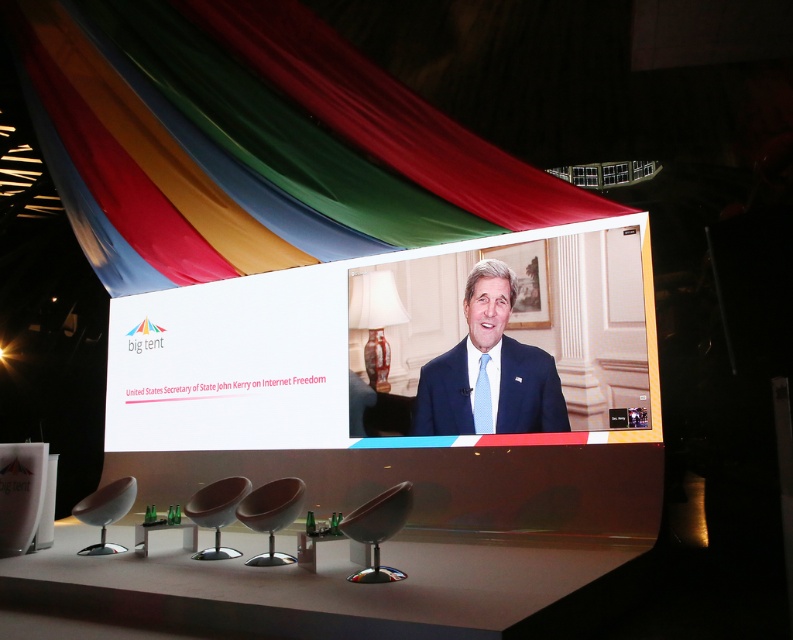
Consider the image. Can you confirm if white glossy projection screen at center is bigger than blue silk tie at center?

Yes.

Image resolution: width=793 pixels, height=640 pixels. What do you see at coordinates (395, 348) in the screenshot?
I see `white glossy projection screen at center` at bounding box center [395, 348].

The width and height of the screenshot is (793, 640). What do you see at coordinates (395, 348) in the screenshot? I see `white glossy projection screen at center` at bounding box center [395, 348].

What are the coordinates of `white glossy projection screen at center` in the screenshot? It's located at (395, 348).

Who is more forward, (274, 80) or (474, 396)?

Point (274, 80) is in front.

Which of these two, multicolored fabric at upper center or blue textured suit at center, stands taller?

multicolored fabric at upper center

Locate an element on the screen. multicolored fabric at upper center is located at coordinates pyautogui.click(x=251, y=144).

Is point (169, 189) less distant than point (481, 394)?

No, it is behind (481, 394).

Does multicolored fabric at upper center appear on the left side of blue silk tie at center?

Yes, multicolored fabric at upper center is to the left of blue silk tie at center.

You are a GUI agent. You are given a task and a screenshot of the screen. Output one action in this format:
    pyautogui.click(x=<x>, y=<y>)
    Task: Click on the multicolored fabric at upper center
    
    Given the screenshot: What is the action you would take?
    pyautogui.click(x=251, y=144)